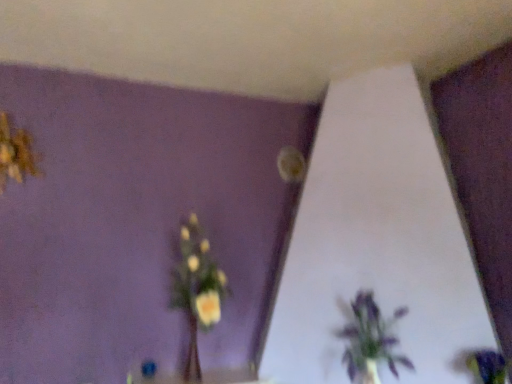
In order to face purple matte flower at lower right, the first flower in the front-to-back sequence, should I rotate leftwards or rightwards?

You should look right and rotate roughly 28.603 degrees.

What is the approximate height of purple matte plant at lower right?

15.57 inches.

Where is `purple matte flower at lower right, placed as the 3th flower when sorted from top to bottom`? This screenshot has width=512, height=384. purple matte flower at lower right, placed as the 3th flower when sorted from top to bottom is located at coordinates (490, 366).

Can you confirm if purple matte plant at lower right is taller than yellow fabric flower at upper left, the 2th flower from the front?

Yes.

How much distance is there between purple matte plant at lower right and yellow fabric flower at upper left, which ranks as the 1th flower in top-to-bottom order?

purple matte plant at lower right and yellow fabric flower at upper left, which ranks as the 1th flower in top-to-bottom order, are 5.28 feet apart.

Does purple matte plant at lower right have a greater width compared to yellow fabric flower at upper left, which is counted as the 3th flower, starting from the right?

Indeed, purple matte plant at lower right has a greater width compared to yellow fabric flower at upper left, which is counted as the 3th flower, starting from the right.

Does purple matte plant at lower right appear on the left side of yellow fabric flower at upper left, which ranks as the 1th flower in top-to-bottom order?

No.

Considering the relative sizes of purple matte flower at lower right, the first flower in the front-to-back sequence, and yellow fabric flower at upper left, the 2th flower when ordered from back to front, in the image provided, is purple matte flower at lower right, the first flower in the front-to-back sequence, smaller than yellow fabric flower at upper left, the 2th flower when ordered from back to front,?

Yes.

This screenshot has height=384, width=512. Find the location of `flower below the yellow fabric flower at upper left, which is counted as the 3th flower, starting from the right (from a real-world perspective)`. flower below the yellow fabric flower at upper left, which is counted as the 3th flower, starting from the right (from a real-world perspective) is located at coordinates (490, 366).

Is purple matte flower at lower right, placed as the 3th flower when sorted from top to bottom, oriented towards yellow fabric flower at upper left, the 2th flower from the front?

No, purple matte flower at lower right, placed as the 3th flower when sorted from top to bottom, is not aimed at yellow fabric flower at upper left, the 2th flower from the front.

Is purple matte flower at lower right, the 1th flower viewed from the right, in front of or behind yellow fabric flower at upper left, the 2th flower when ordered from back to front, in the image?

Visually, purple matte flower at lower right, the 1th flower viewed from the right, is located in front of yellow fabric flower at upper left, the 2th flower when ordered from back to front.

Looking at the image, does matte yellow flower at upper center, the second flower in the bottom-to-top sequence, seem bigger or smaller compared to yellow fabric flower at upper left, which is counted as the 3th flower, starting from the right?

Clearly, matte yellow flower at upper center, the second flower in the bottom-to-top sequence, is smaller in size than yellow fabric flower at upper left, which is counted as the 3th flower, starting from the right.

Which of these two, matte yellow flower at upper center, which is the first flower in back-to-front order, or yellow fabric flower at upper left, the 2th flower from the front, is thinner?

matte yellow flower at upper center, which is the first flower in back-to-front order.

Would you say yellow fabric flower at upper left, which appears as the third flower when ordered from the bottom, is part of matte yellow flower at upper center, which is the first flower in back-to-front order,'s contents?

No, yellow fabric flower at upper left, which appears as the third flower when ordered from the bottom, is not a part of matte yellow flower at upper center, which is the first flower in back-to-front order.

Is yellow fabric flower at upper left, which appears as the third flower when ordered from the bottom, at the back of matte yellow flower at upper center, the second flower positioned from the left?

matte yellow flower at upper center, the second flower positioned from the left, does not have its back to yellow fabric flower at upper left, which appears as the third flower when ordered from the bottom.

Which point is more forward, (208, 271) or (388, 333)?

The point (388, 333) is in front.

From the image's perspective, is yellow matte vase at center below purple matte plant at lower right?

Incorrect, from the image's perspective, yellow matte vase at center is higher than purple matte plant at lower right.

Is yellow matte vase at center taller than purple matte plant at lower right?

Correct, yellow matte vase at center is much taller as purple matte plant at lower right.

Is yellow matte vase at center facing towards purple matte plant at lower right?

No, yellow matte vase at center is not aimed at purple matte plant at lower right.

From the image's perspective, which object appears higher, purple matte flower at lower right, the 3th flower viewed from the back, or matte yellow flower at upper center, the second flower in the bottom-to-top sequence?

matte yellow flower at upper center, the second flower in the bottom-to-top sequence, appears higher in the image.

Is purple matte flower at lower right, the 1th flower viewed from the right, in front of or behind matte yellow flower at upper center, the third flower from the front, in the image?

purple matte flower at lower right, the 1th flower viewed from the right, is in front of matte yellow flower at upper center, the third flower from the front.

Considering the relative sizes of purple matte flower at lower right, the 1th flower viewed from the right, and matte yellow flower at upper center, the second flower viewed from the right, in the image provided, is purple matte flower at lower right, the 1th flower viewed from the right, bigger than matte yellow flower at upper center, the second flower viewed from the right,?

Yes, purple matte flower at lower right, the 1th flower viewed from the right, is bigger than matte yellow flower at upper center, the second flower viewed from the right.

Does yellow fabric flower at upper left, which ranks as the 1th flower in top-to-bottom order, touch purple matte flower at lower right, arranged as the 1th flower when ordered from the bottom?

No, yellow fabric flower at upper left, which ranks as the 1th flower in top-to-bottom order, is not in contact with purple matte flower at lower right, arranged as the 1th flower when ordered from the bottom.

Is yellow fabric flower at upper left, the 2th flower when ordered from back to front, to the left or to the right of purple matte flower at lower right, arranged as the 1th flower when ordered from the bottom, in the image?

Based on their positions, yellow fabric flower at upper left, the 2th flower when ordered from back to front, is located to the left of purple matte flower at lower right, arranged as the 1th flower when ordered from the bottom.

Between yellow fabric flower at upper left, which ranks as the 1th flower in top-to-bottom order, and purple matte flower at lower right, positioned as the third flower in left-to-right order, which one has smaller size?

purple matte flower at lower right, positioned as the third flower in left-to-right order.

Could you tell me if yellow fabric flower at upper left, the 2th flower when ordered from back to front, is turned towards purple matte flower at lower right, positioned as the third flower in left-to-right order?

No, yellow fabric flower at upper left, the 2th flower when ordered from back to front, does not turn towards purple matte flower at lower right, positioned as the third flower in left-to-right order.

From a real-world perspective, between yellow fabric flower at upper left, which is counted as the 3th flower, starting from the right, and purple matte plant at lower right, who is vertically lower?

purple matte plant at lower right, from a real-world perspective.

How distant is yellow fabric flower at upper left, which ranks as the 1th flower in top-to-bottom order, from purple matte plant at lower right?

They are 5.28 feet apart.

Looking at this image, is purple matte plant at lower right inside yellow fabric flower at upper left, which appears as the third flower when ordered from the bottom?

That's incorrect, purple matte plant at lower right is not inside yellow fabric flower at upper left, which appears as the third flower when ordered from the bottom.

How many degrees apart are the facing directions of yellow fabric flower at upper left, which is the first flower from left to right, and purple matte plant at lower right?

47.2 degrees separate the facing orientations of yellow fabric flower at upper left, which is the first flower from left to right, and purple matte plant at lower right.

Find the location of a particular element. This screenshot has width=512, height=384. houseplant located on the right of yellow fabric flower at upper left, the 2th flower when ordered from back to front is located at coordinates (370, 340).

Which flower is the 1st one when counting from the back of the purple matte flower at lower right, the first flower in the front-to-back sequence? Please provide its 2D coordinates.

[(17, 153)]

Which object lies nearer to the anchor point yellow matte vase at center, yellow fabric flower at upper left, the 2th flower when ordered from back to front, or matte yellow flower at upper center, which appears as the second flower when viewed from the top?

matte yellow flower at upper center, which appears as the second flower when viewed from the top, lies closer to yellow matte vase at center than the other object.

From the image, which object appears to be farther from purple matte plant at lower right, matte yellow flower at upper center, which appears as the second flower when viewed from the top, or purple matte flower at lower right, the first flower in the front-to-back sequence?

Among the two, matte yellow flower at upper center, which appears as the second flower when viewed from the top, is located further to purple matte plant at lower right.

Looking at the image, which one is located further to matte yellow flower at upper center, the second flower in the bottom-to-top sequence, yellow fabric flower at upper left, which ranks as the 1th flower in top-to-bottom order, or yellow matte vase at center?

Among the two, yellow fabric flower at upper left, which ranks as the 1th flower in top-to-bottom order, is located further to matte yellow flower at upper center, the second flower in the bottom-to-top sequence.

Considering their positions, is purple matte plant at lower right positioned further to matte yellow flower at upper center, which is the first flower in back-to-front order, than yellow matte vase at center?

Based on the image, purple matte plant at lower right appears to be further to matte yellow flower at upper center, which is the first flower in back-to-front order.

Looking at the image, which one is located closer to purple matte plant at lower right, purple matte flower at lower right, the 1th flower viewed from the right, or yellow matte vase at center?

purple matte flower at lower right, the 1th flower viewed from the right, lies closer to purple matte plant at lower right than the other object.

Looking at the image, which one is located closer to yellow fabric flower at upper left, which ranks as the 1th flower in top-to-bottom order, matte yellow flower at upper center, which appears as the second flower when viewed from the top, or purple matte flower at lower right, positioned as the third flower in left-to-right order?

matte yellow flower at upper center, which appears as the second flower when viewed from the top, is positioned closer to the anchor yellow fabric flower at upper left, which ranks as the 1th flower in top-to-bottom order.

Considering their positions, is purple matte flower at lower right, the 3th flower viewed from the back, positioned closer to yellow matte vase at center than yellow fabric flower at upper left, the 2th flower when ordered from back to front?

Among the two, yellow fabric flower at upper left, the 2th flower when ordered from back to front, is located nearer to yellow matte vase at center.

Looking at this image, based on their spatial positions, is purple matte flower at lower right, the first flower in the front-to-back sequence, or matte yellow flower at upper center, which appears as the second flower when viewed from the top, closer to purple matte plant at lower right?

purple matte flower at lower right, the first flower in the front-to-back sequence, is positioned closer to the anchor purple matte plant at lower right.

Where is `floral arrangement between yellow fabric flower at upper left, which is counted as the 3th flower, starting from the right, and purple matte flower at lower right, positioned as the third flower in left-to-right order, from left to right`? floral arrangement between yellow fabric flower at upper left, which is counted as the 3th flower, starting from the right, and purple matte flower at lower right, positioned as the third flower in left-to-right order, from left to right is located at coordinates (197, 289).

Where is `houseplant located between purple matte flower at lower right, placed as the 3th flower when sorted from top to bottom, and matte yellow flower at upper center, which is the first flower in back-to-front order, in the depth direction`? The height and width of the screenshot is (384, 512). houseplant located between purple matte flower at lower right, placed as the 3th flower when sorted from top to bottom, and matte yellow flower at upper center, which is the first flower in back-to-front order, in the depth direction is located at coordinates (370, 340).

Identify the location of flower between yellow matte vase at center and purple matte flower at lower right, arranged as the 1th flower when ordered from the bottom, in the horizontal direction. Image resolution: width=512 pixels, height=384 pixels. [291, 164].

Locate an element on the screen. floral arrangement situated between yellow fabric flower at upper left, which ranks as the 1th flower in top-to-bottom order, and matte yellow flower at upper center, which is the first flower in back-to-front order, from left to right is located at coordinates (197, 289).